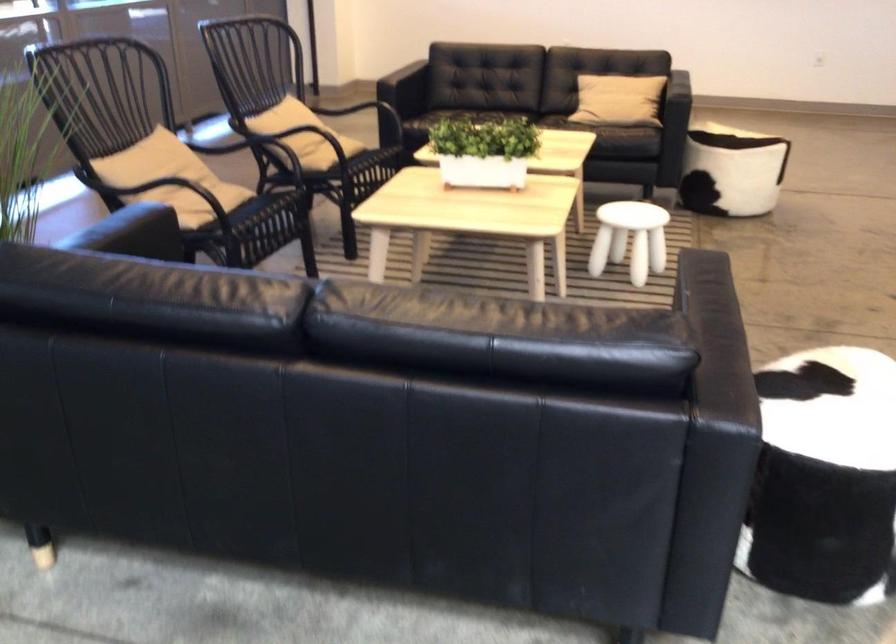
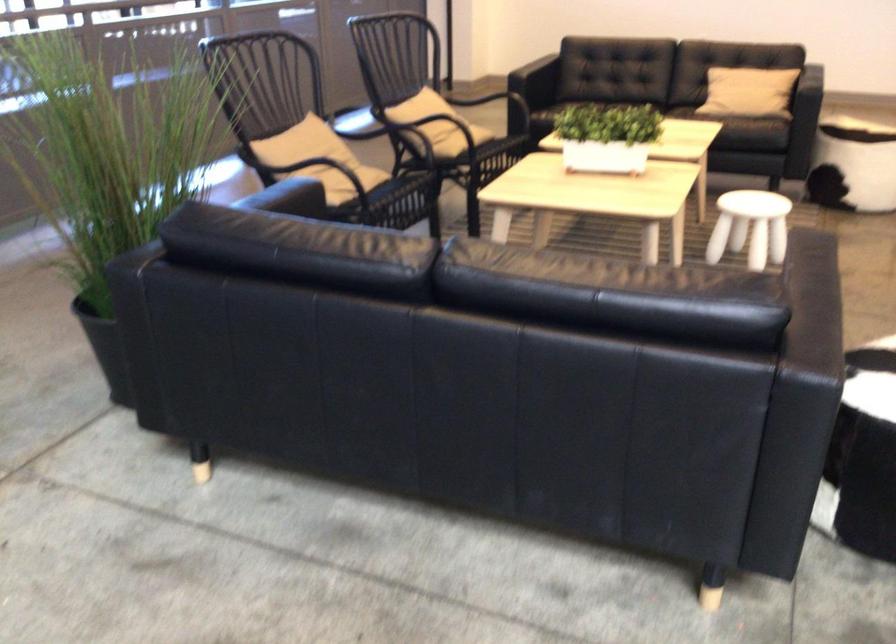
In the second image, find the point that corresponds to (x=289, y=126) in the first image.

(431, 111)